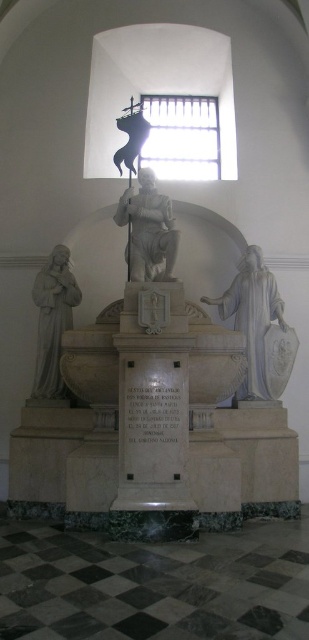
Question: Which object is the closest to the white marble statue at right?

Choices:
 (A) white marble statue at center
 (B) white marble statue at left
 (C) matte white statue at upper center
 (D) white marble monument at center

Answer: (A)

Question: Can you confirm if white marble monument at center is positioned to the left of white marble statue at right?

Choices:
 (A) no
 (B) yes

Answer: (B)

Question: Which object appears closest to the camera in this image?

Choices:
 (A) white marble monument at center
 (B) matte white statue at upper center
 (C) white marble statue at left
 (D) white marble statue at center

Answer: (A)

Question: Does white marble monument at center have a smaller size compared to matte white statue at upper center?

Choices:
 (A) yes
 (B) no

Answer: (B)

Question: Estimate the real-world distances between objects in this image. Which object is farther from the white marble monument at center?

Choices:
 (A) white marble statue at right
 (B) white marble statue at left
 (C) matte white statue at upper center

Answer: (C)

Question: Can you confirm if white marble statue at left is thinner than white marble statue at center?

Choices:
 (A) yes
 (B) no

Answer: (A)